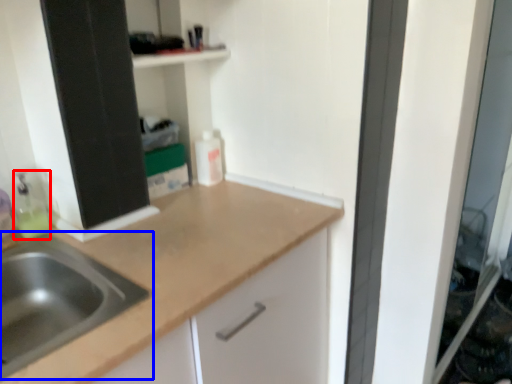
Question: Among these objects, which one is nearest to the camera, cleaning product (highlighted by a red box) or sink (highlighted by a blue box)?

Choices:
 (A) cleaning product
 (B) sink

Answer: (B)